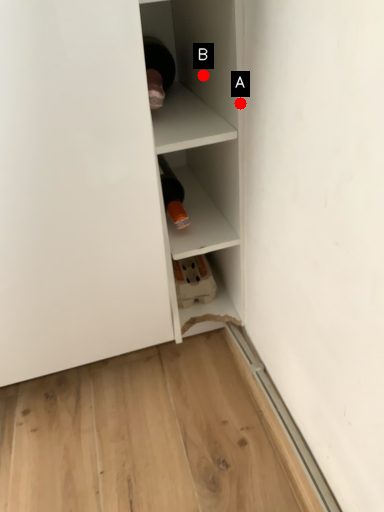
Question: Two points are circled on the image, labeled by A and B beside each circle. Which point is farther from the camera taking this photo?

Choices:
 (A) A is further
 (B) B is further

Answer: (B)